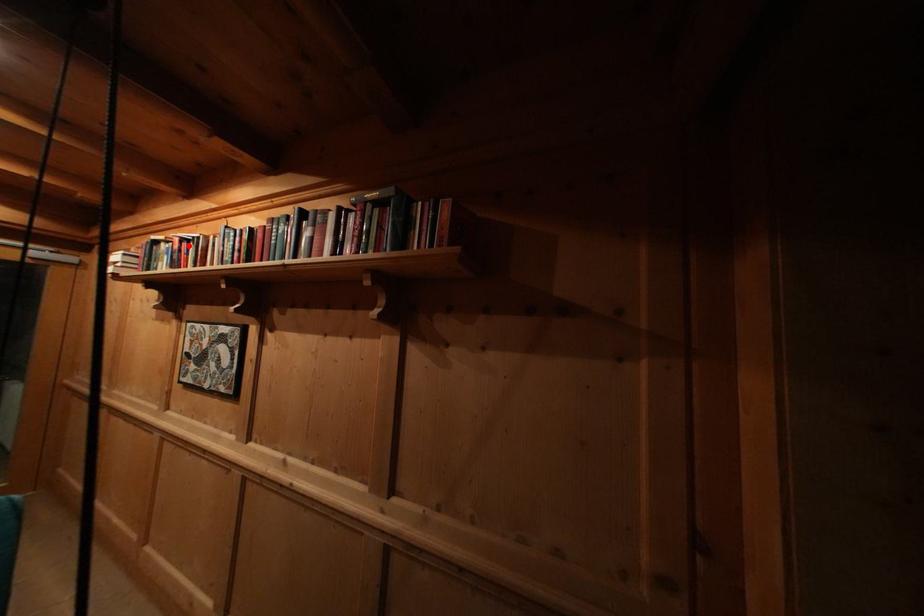
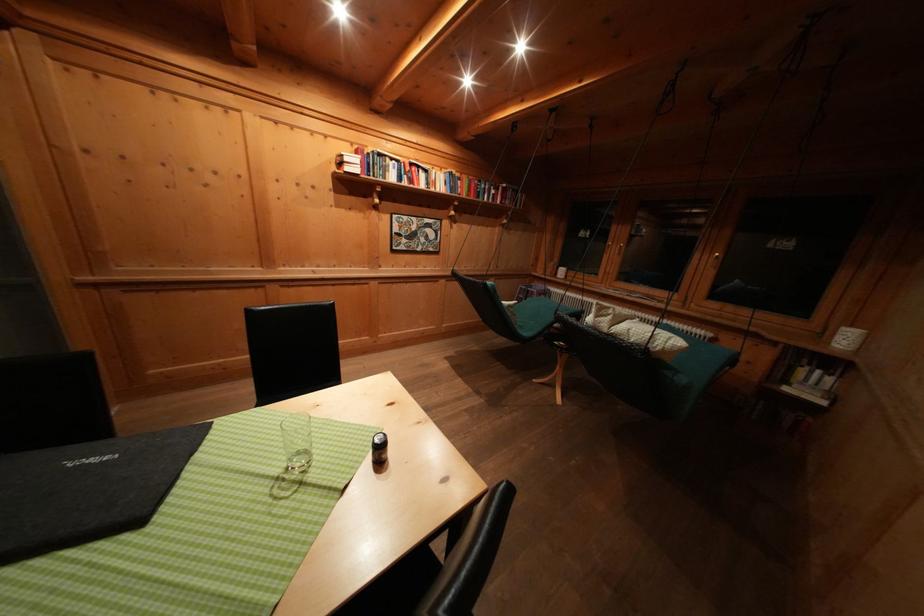
Where in the second image is the point corresponding to the highlighted location from the first image?

(418, 169)